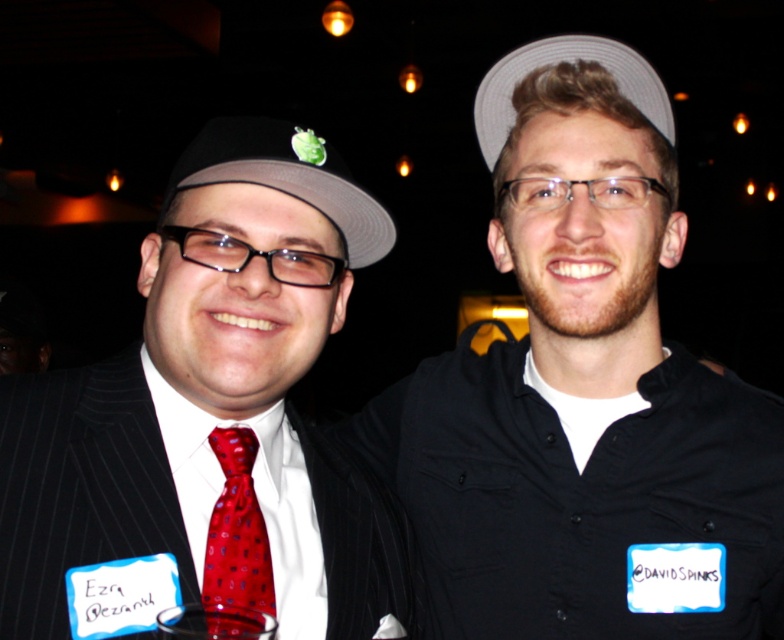
Question: Is black matte shirt at center to the left of matte black suit at left from the viewer's perspective?

Choices:
 (A) no
 (B) yes

Answer: (A)

Question: Estimate the real-world distances between objects in this image. Which object is closer to the transparent plastic wine glass at center?

Choices:
 (A) matte black suit at left
 (B) shiny red tie at center

Answer: (B)

Question: Does matte black suit at left appear on the left side of transparent plastic wine glass at center?

Choices:
 (A) yes
 (B) no

Answer: (A)

Question: Considering the real-world distances, which object is closest to the matte black suit at left?

Choices:
 (A) transparent plastic wine glass at center
 (B) white fabric baseball hat at upper center

Answer: (A)

Question: From the image, what is the correct spatial relationship of black matte shirt at center in relation to transparent plastic wine glass at center?

Choices:
 (A) below
 (B) above

Answer: (B)

Question: Which point is closer to the camera?

Choices:
 (A) white fabric baseball hat at upper center
 (B) transparent plastic wine glass at center

Answer: (B)